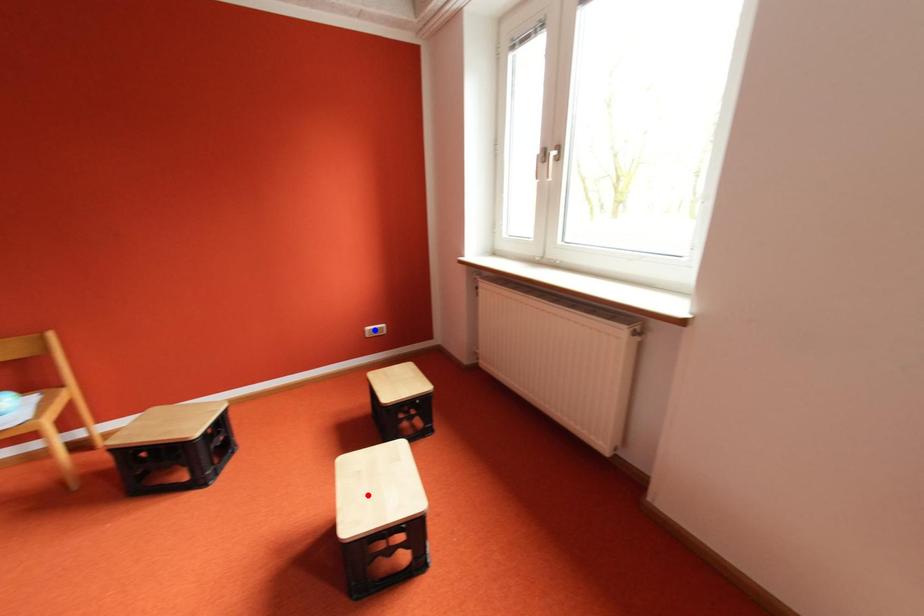
Question: Two points are marked on the image. Which point is closer to the camera?

Choices:
 (A) Blue point is closer.
 (B) Red point is closer.

Answer: (B)